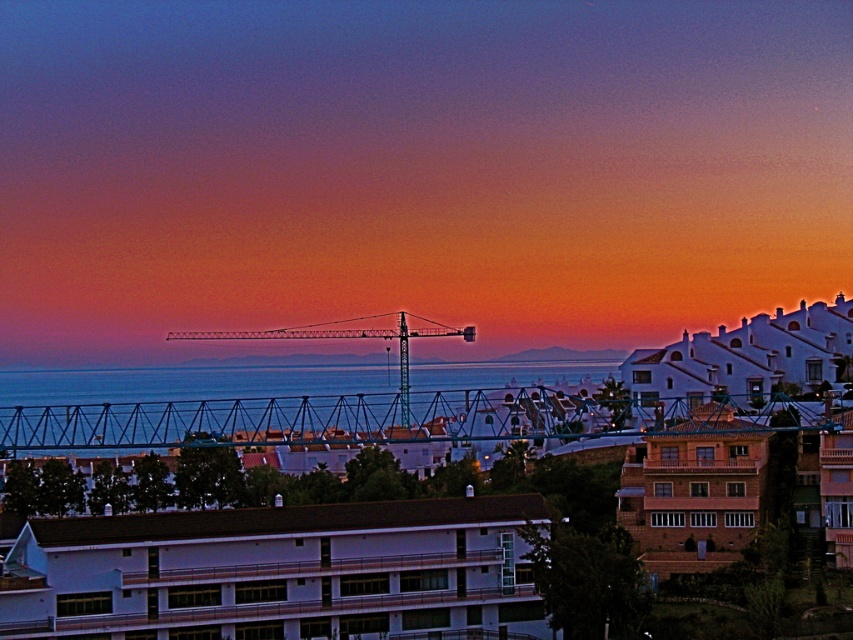
Between blue water at center and teal metallic crane at center, which one is positioned higher?

teal metallic crane at center is higher up.

Between blue water at center and teal metallic crane at center, which one appears on the left side from the viewer's perspective?

From the viewer's perspective, teal metallic crane at center appears more on the left side.

Is point (222, 381) positioned after point (404, 417)?

Yes, it is.

This screenshot has height=640, width=853. I want to click on blue water at center, so click(193, 381).